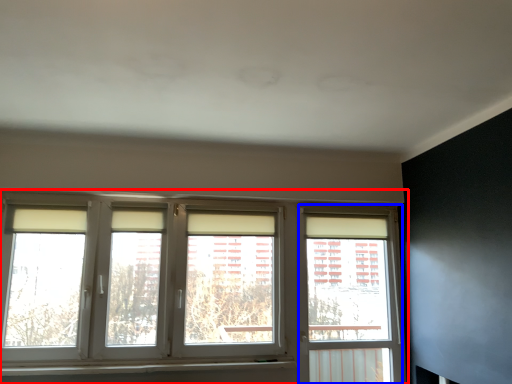
Question: Among these objects, which one is nearest to the camera, window (highlighted by a red box) or window frame (highlighted by a blue box)?

Choices:
 (A) window
 (B) window frame

Answer: (A)